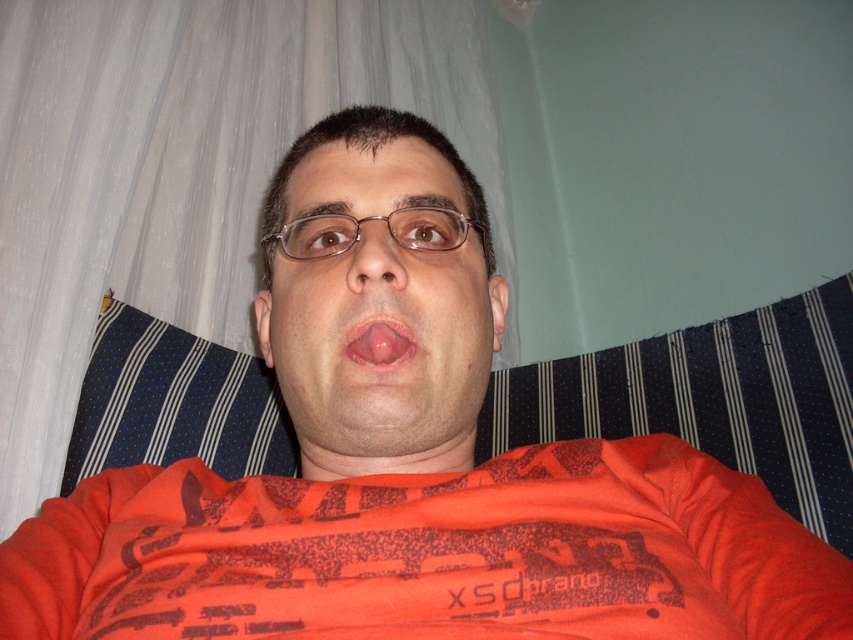
You are taking a photo of the person in the scene. The matte orange face at center and the pink glossy tongue at center are both in the frame. Which object is positioned to the right side of the other?

The pink glossy tongue at center is positioned to the right of the matte orange face at center.

You are a photographer trying to capture a closeup of the person in the image. You notice the matte brown nose at center and the pink glossy tongue at center. Which object is positioned closer to the camera?

The matte brown nose at center is closer to the viewer than the pink glossy tongue at center, so the nose would appear closer to the camera.

You are designing a poster and want to place a matte orange face at center and a pink glossy tongue at center in a way that follows the original image. Which object should be placed higher?

The matte orange face at center should be placed higher since it is above the pink glossy tongue at center in the original image.